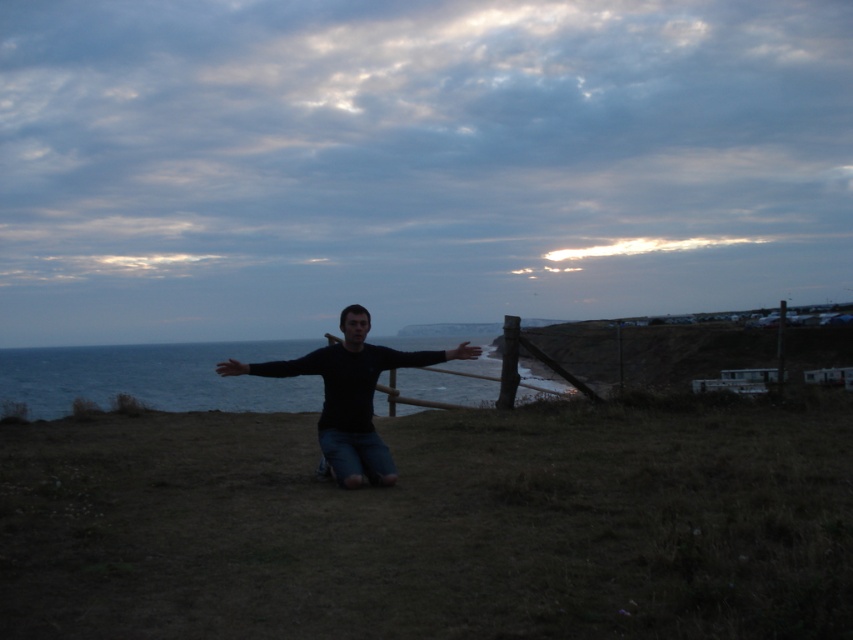
Who is shorter, blue water at center or black matte arm at center?

With less height is black matte arm at center.

Does point (293, 408) lie behind point (392, 364)?

Yes, it is.

The height and width of the screenshot is (640, 853). Describe the element at coordinates (155, 376) in the screenshot. I see `blue water at center` at that location.

Identify the location of blue water at center. (155, 376).

Between black matte shirt at center and black matte arm at center, which one is positioned higher?

black matte arm at center is higher up.

Who is more distant from viewer, (364, 385) or (410, 362)?

The point (410, 362) is more distant.

I want to click on black matte shirt at center, so click(350, 397).

Who is positioned more to the right, brown grassy at center or black matte shirt at center?

Positioned to the right is black matte shirt at center.

Is brown grassy at center positioned in front of black matte shirt at center?

Yes, it is.

Which is behind, point (280, 620) or point (334, 376)?

Point (334, 376)

I want to click on brown grassy at center, so click(436, 524).